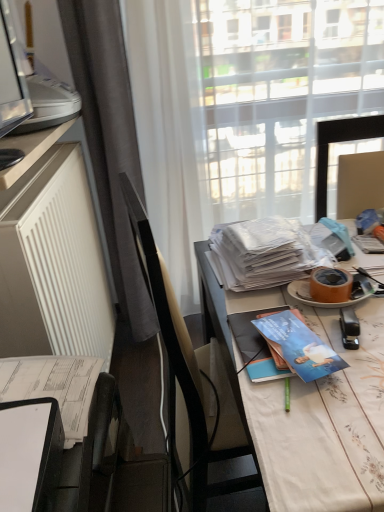
Identify the location of free spot in front of orange matte plate at right. (351, 333).